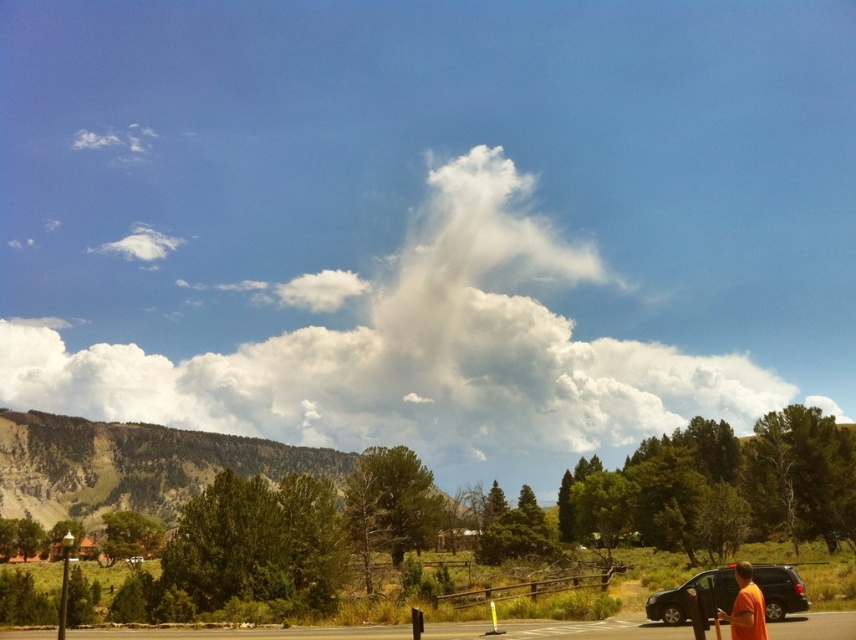
Does white fluffy cloud at upper center appear over orange t-shirt at lower right?

Yes.

Identify the location of white fluffy cloud at upper center. (413, 349).

In the scene shown: Is matte black suv at lower right bigger than orange t-shirt at lower right?

Yes.

Can you confirm if matte black suv at lower right is positioned to the right of orange t-shirt at lower right?

In fact, matte black suv at lower right is to the left of orange t-shirt at lower right.

The image size is (856, 640). Describe the element at coordinates (697, 595) in the screenshot. I see `matte black suv at lower right` at that location.

Find the location of a particular element. This screenshot has width=856, height=640. matte black suv at lower right is located at coordinates (697, 595).

Does white fluffy cloud at upper center appear under matte black suv at lower right?

No.

Which is above, white fluffy cloud at upper center or matte black suv at lower right?

white fluffy cloud at upper center is higher up.

Who is more forward, (424, 285) or (798, 602)?

Point (798, 602) is in front.

This screenshot has width=856, height=640. Find the location of `white fluffy cloud at upper center`. white fluffy cloud at upper center is located at coordinates (413, 349).